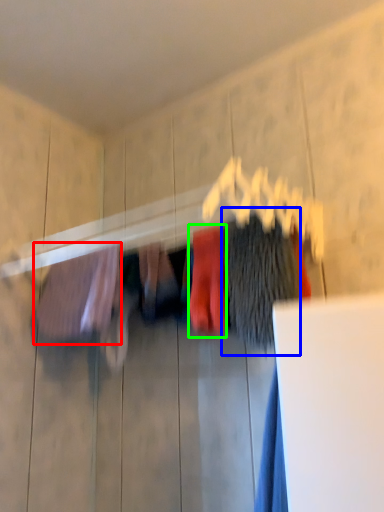
Question: Which object is positioned farthest from clothing (highlighted by a red box)? Select from clothing (highlighted by a blue box) and clothing (highlighted by a green box).

Choices:
 (A) clothing
 (B) clothing

Answer: (A)